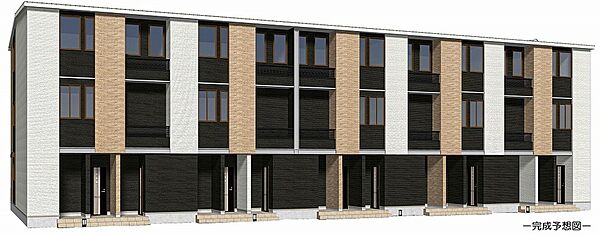
Identify the location of blind. This screenshot has width=600, height=235. (373, 111), (210, 110), (75, 106), (471, 109), (563, 120).